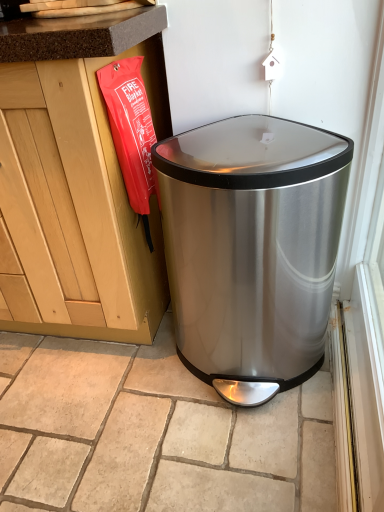
Locate an element on the screen. unoccupied area in front of stainless steel trash can at lower right is located at coordinates (240, 457).